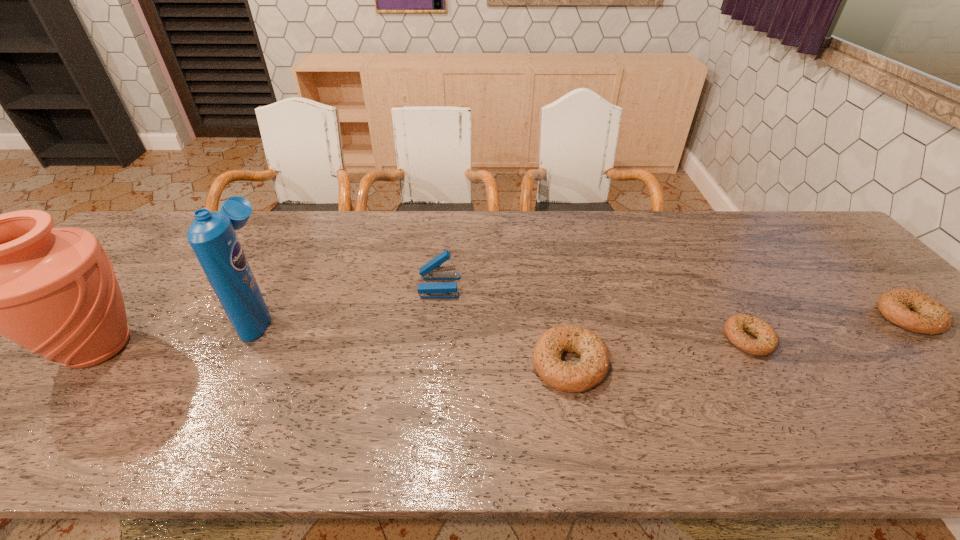
What are the coordinates of `free location located 0.110m on the right of the leftmost object` in the screenshot? It's located at (194, 347).

Identify the location of vacant space located on the back of the shampoo. The width and height of the screenshot is (960, 540). (299, 243).

Find the location of a particular element. This screenshot has width=960, height=540. vacant space located on the right of the third object from left to right is located at coordinates (485, 286).

At what (x,y) coordinates should I click in order to perform the action: click on bagel that is at the near edge. Please return your answer as a coordinate pair (x, y). The image size is (960, 540). Looking at the image, I should click on (593, 366).

The width and height of the screenshot is (960, 540). I want to click on vase that is positioned at the near edge, so click(x=53, y=291).

Find the location of a particular element. object that is at the left edge is located at coordinates (53, 291).

Locate an element on the screen. object located at the near left corner is located at coordinates (53, 291).

The image size is (960, 540). I want to click on vacant space at the far edge of the desktop, so click(497, 242).

Where is `free space at the near edge of the desktop`? free space at the near edge of the desktop is located at coordinates (835, 407).

At what (x,y) coordinates should I click in order to perform the action: click on vacant area at the left edge. Please return your answer as a coordinate pair (x, y). Looking at the image, I should click on point(126,259).